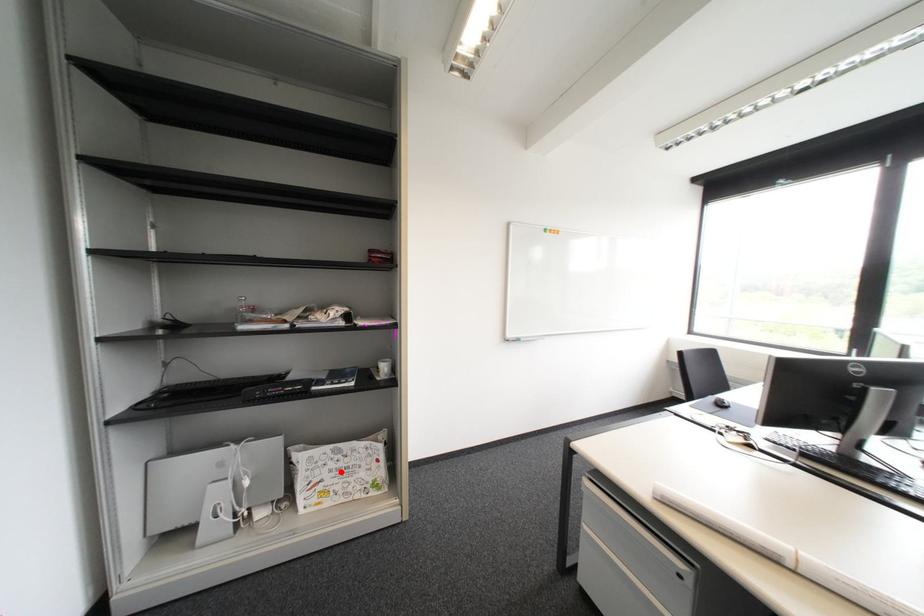
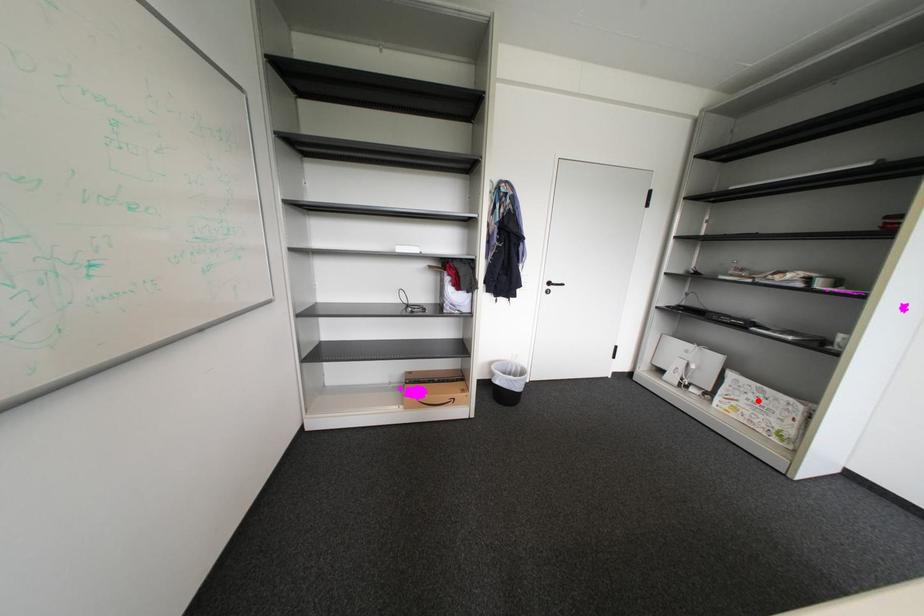
I am providing you with two images of the same scene from different viewpoints. A red point is marked on the first image and another point is marked on the second image. Is the red point in image1 aligned with the point shown in image2?

Yes